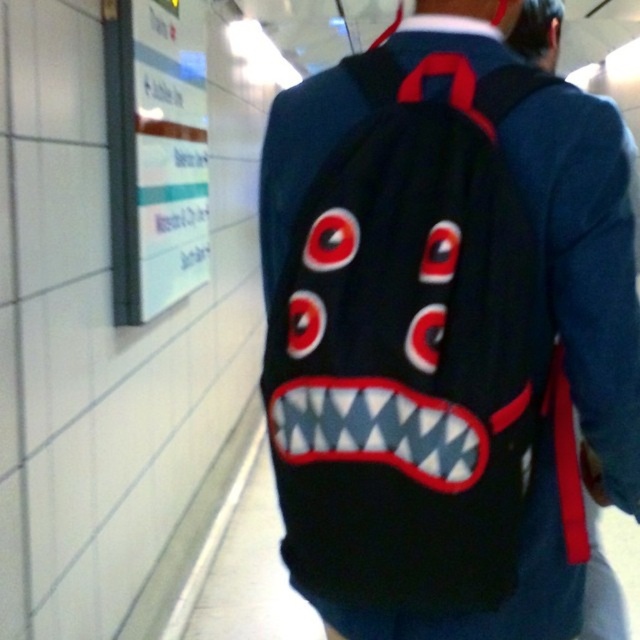
Is black fabric backpack at upper center shorter than white glossy signboard at upper left?

Indeed, black fabric backpack at upper center has a lesser height compared to white glossy signboard at upper left.

Is black fabric backpack at upper center to the left of white glossy signboard at upper left from the viewer's perspective?

Incorrect, black fabric backpack at upper center is not on the left side of white glossy signboard at upper left.

What do you see at coordinates (448, 328) in the screenshot? This screenshot has height=640, width=640. I see `black fabric backpack at upper center` at bounding box center [448, 328].

Identify the location of black fabric backpack at upper center. (448, 328).